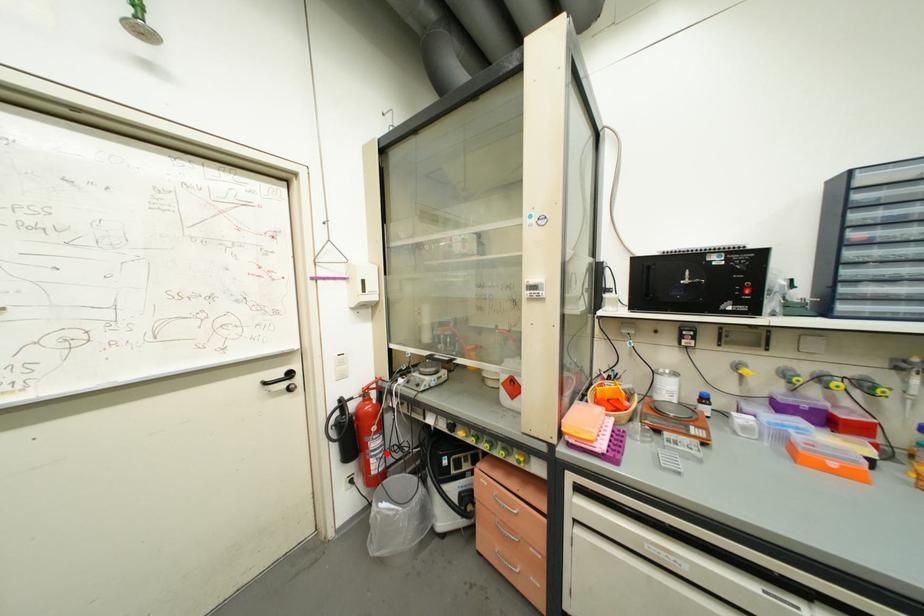
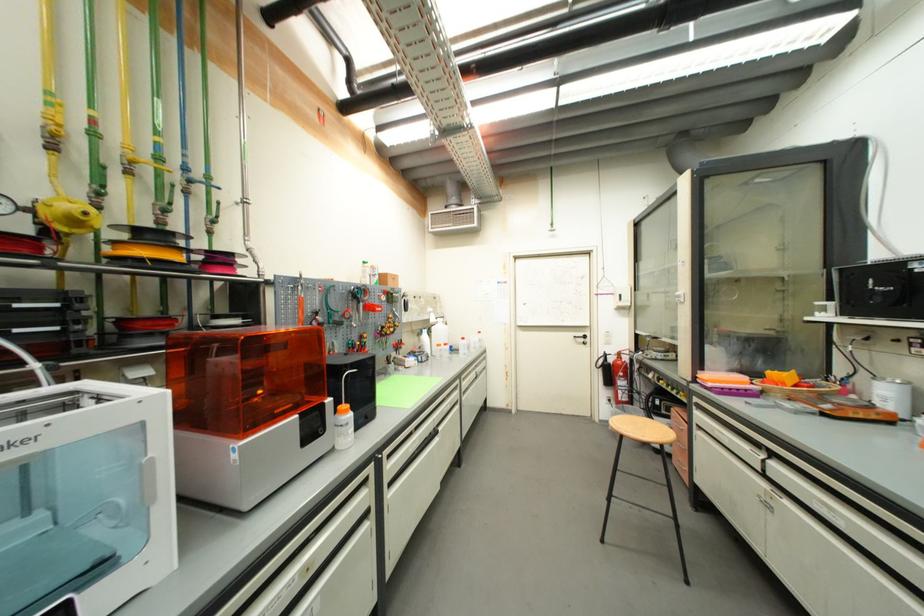
Question: I am providing you with two images of the same scene from different viewpoints. In image1, a red point is highlighted. Considering the same 3D point in image2, which of the following is correct?

Choices:
 (A) It is closer
 (B) It is farther

Answer: (B)